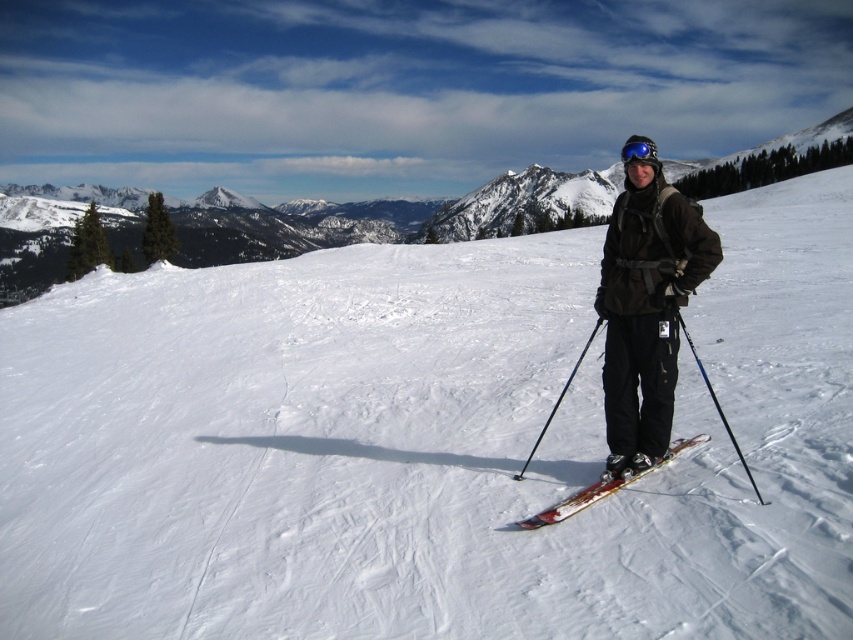
Question: Which point is closer to the camera taking this photo?

Choices:
 (A) (734, 445)
 (B) (651, 157)
 (C) (579, 355)

Answer: (A)

Question: Is matte black ski suit at center thinner than black plastic ski pole at center?

Choices:
 (A) no
 (B) yes

Answer: (A)

Question: Where is matte black ski suit at center located in relation to black plastic ski pole at center in the image?

Choices:
 (A) below
 (B) above

Answer: (B)

Question: Can you confirm if blue metallic ski pole at center is positioned below black plastic ski pole at center?

Choices:
 (A) no
 (B) yes

Answer: (B)

Question: Which object appears closest to the camera in this image?

Choices:
 (A) blue reflective goggles at center
 (B) black plastic ski pole at center

Answer: (A)

Question: Which point is closer to the camera?

Choices:
 (A) blue reflective goggles at center
 (B) white powder snow at center

Answer: (B)